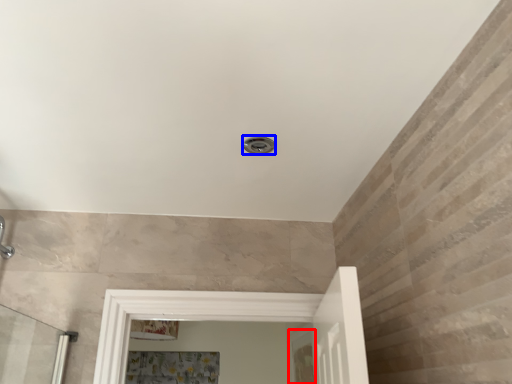
Question: Which object appears closest to the camera in this image, screen door (highlighted by a red box) or shower (highlighted by a blue box)?

Choices:
 (A) screen door
 (B) shower

Answer: (B)